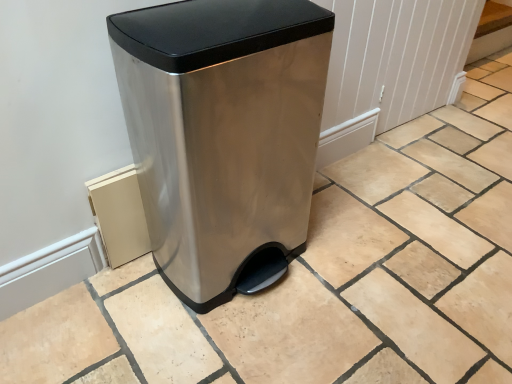
The width and height of the screenshot is (512, 384). Find the location of `free area below stainless steel trash can at center (from a real-world perspective)`. free area below stainless steel trash can at center (from a real-world perspective) is located at coordinates (237, 260).